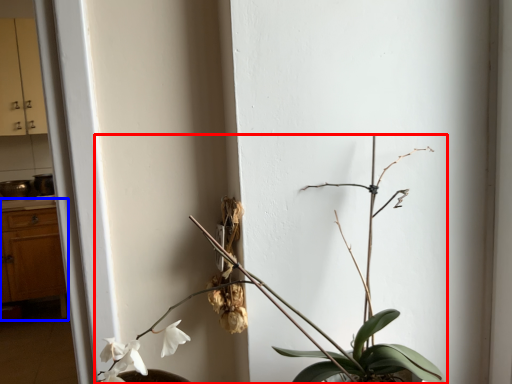
Question: Which object is further to the camera taking this photo, houseplant (highlighted by a red box) or dresser (highlighted by a blue box)?

Choices:
 (A) houseplant
 (B) dresser

Answer: (B)